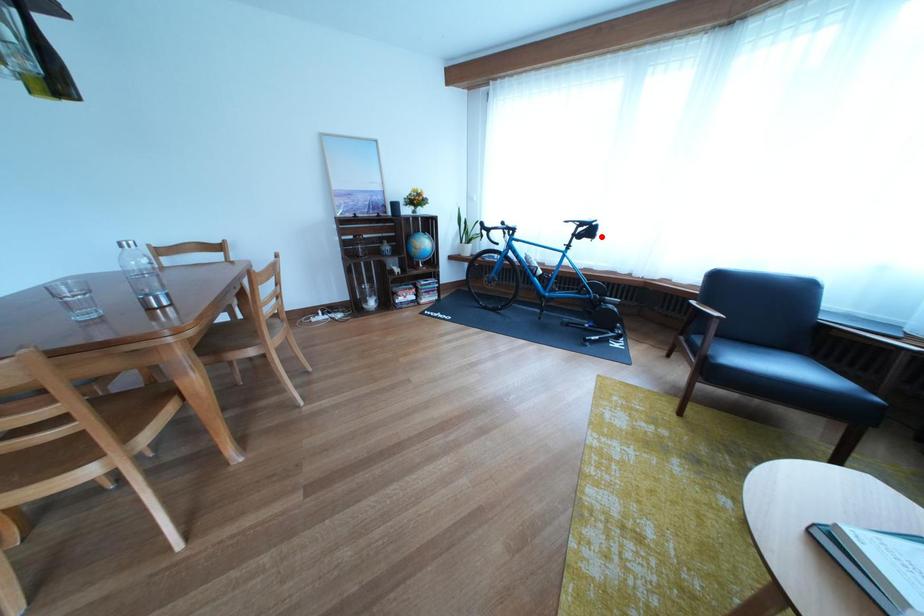
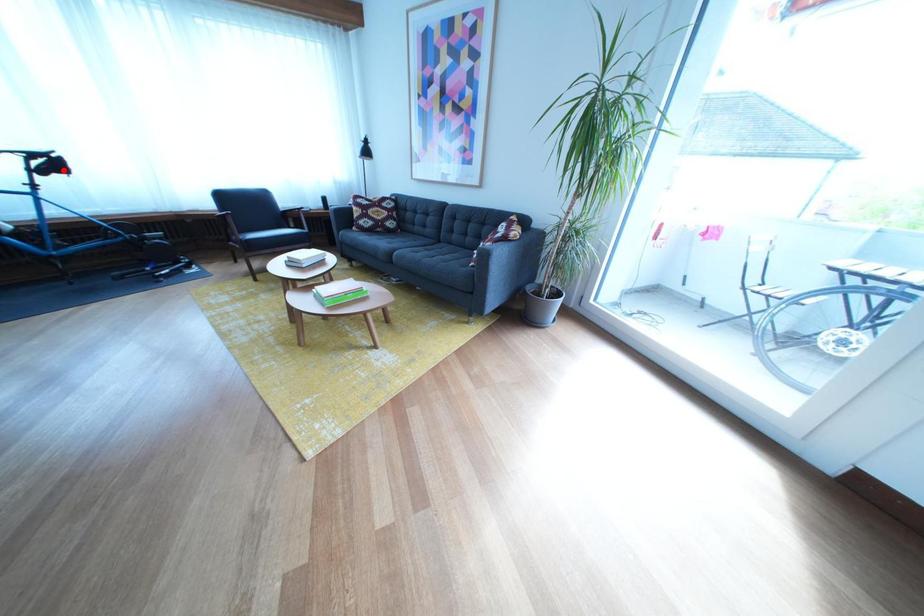
I am providing you with two images of the same scene from different viewpoints. A red point is marked on the first image and another point is marked on the second image. Is the marked point in image1 the same physical position as the marked point in image2?

Yes